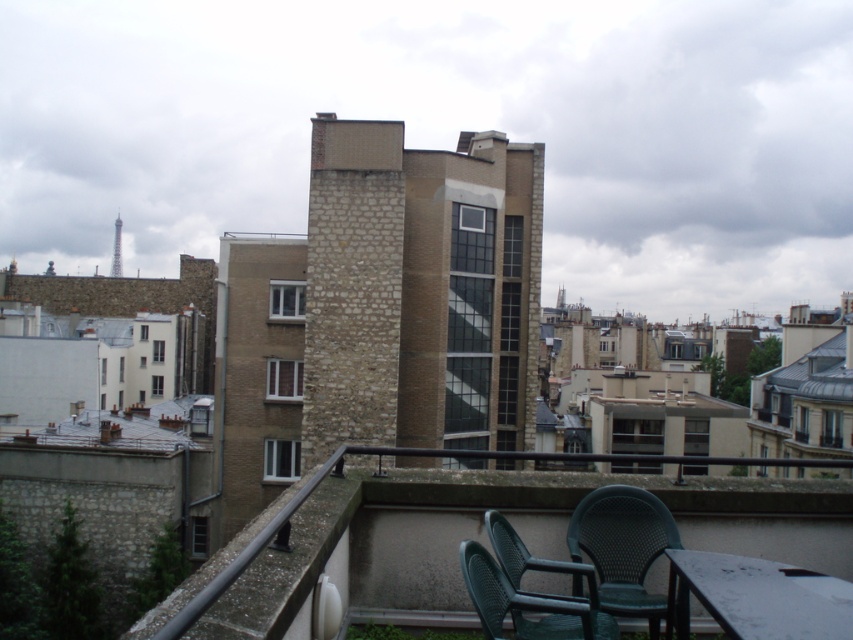
Which is behind, point (155, 609) or point (352, 355)?

Positioned behind is point (352, 355).

Can you confirm if green plastic chairs at lower right is smaller than brown stone chimney at center?

No, green plastic chairs at lower right is not smaller than brown stone chimney at center.

From the picture: Who is more distant from viewer, (280, 611) or (343, 145)?

The point (343, 145) is more distant.

The height and width of the screenshot is (640, 853). I want to click on green plastic chairs at lower right, so click(x=477, y=538).

Can you confirm if brown stone chimney at center is taller than green mesh chair at lower center?

Yes, brown stone chimney at center is taller than green mesh chair at lower center.

Which is more to the right, brown stone chimney at center or green mesh chair at lower center?

From the viewer's perspective, green mesh chair at lower center appears more on the right side.

What do you see at coordinates (352, 284) in the screenshot?
I see `brown stone chimney at center` at bounding box center [352, 284].

Where is `brown stone chimney at center`? The width and height of the screenshot is (853, 640). brown stone chimney at center is located at coordinates [352, 284].

Between green plastic chairs at lower right and white glossy table at lower right, which one has less height?

Standing shorter between the two is white glossy table at lower right.

Looking at this image, is green plastic chairs at lower right bigger than white glossy table at lower right?

Yes.

Is point (428, 577) positioned behind point (712, 600)?

Yes.

Where is `green plastic chairs at lower right`? Image resolution: width=853 pixels, height=640 pixels. green plastic chairs at lower right is located at coordinates (477, 538).